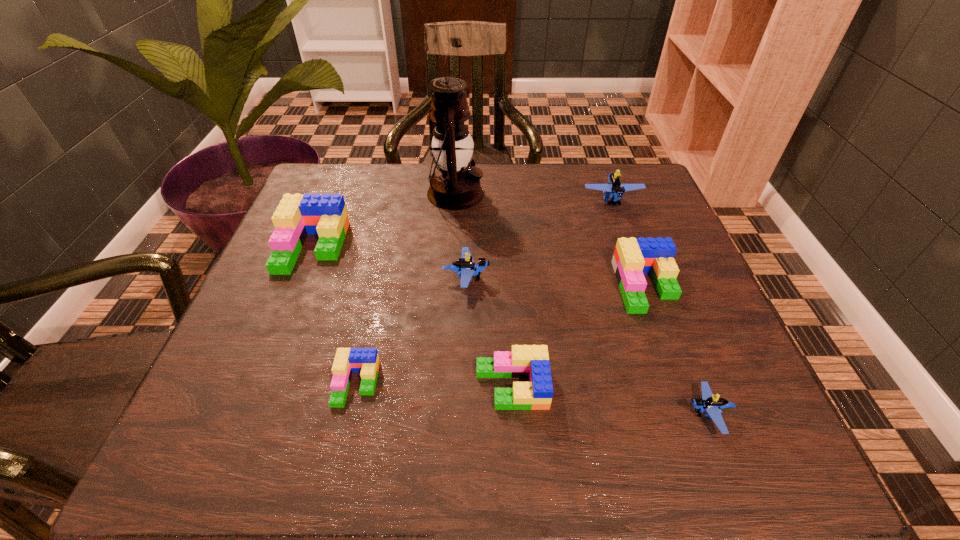
Image resolution: width=960 pixels, height=540 pixels. In order to click on green Lego that can be found as the second closest to the shortest object in this screenshot , I will do `click(296, 216)`.

Locate an element on the screen. The image size is (960, 540). green Lego identified as the third closest to the second green Lego from left to right is located at coordinates (633, 257).

The width and height of the screenshot is (960, 540). In order to click on blank space that satisfies the following two spatial constraints: 1. on the back side of the third smallest green Lego; 2. on the front-facing side of the leftmost blue Lego in this screenshot , I will do `click(643, 278)`.